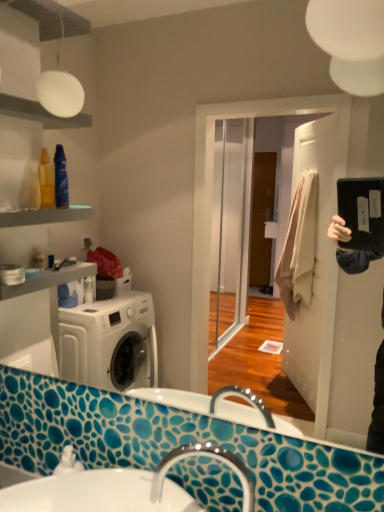
Question: Is silver metallic faucet at lower center inside matte black mirror at upper right?

Choices:
 (A) yes
 (B) no

Answer: (B)

Question: Is matte black mirror at upper right located outside silver metallic faucet at lower center?

Choices:
 (A) yes
 (B) no

Answer: (A)

Question: Does matte black mirror at upper right have a greater height compared to silver metallic faucet at lower center?

Choices:
 (A) no
 (B) yes

Answer: (B)

Question: Is matte black mirror at upper right thinner than silver metallic faucet at lower center?

Choices:
 (A) no
 (B) yes

Answer: (B)

Question: Does matte black mirror at upper right have a lesser height compared to silver metallic faucet at lower center?

Choices:
 (A) no
 (B) yes

Answer: (A)

Question: Considering the relative sizes of matte black mirror at upper right and silver metallic faucet at lower center in the image provided, is matte black mirror at upper right wider than silver metallic faucet at lower center?

Choices:
 (A) no
 (B) yes

Answer: (A)

Question: Is white glossy sink at lower center thinner than silver metallic faucet at lower center?

Choices:
 (A) no
 (B) yes

Answer: (A)

Question: Is white glossy sink at lower center outside silver metallic faucet at lower center?

Choices:
 (A) no
 (B) yes

Answer: (B)

Question: Is silver metallic faucet at lower center completely or partially inside white glossy sink at lower center?

Choices:
 (A) no
 (B) yes

Answer: (A)

Question: Is white glossy sink at lower center turned away from silver metallic faucet at lower center?

Choices:
 (A) yes
 (B) no

Answer: (B)

Question: Is white glossy sink at lower center shorter than silver metallic faucet at lower center?

Choices:
 (A) no
 (B) yes

Answer: (B)

Question: Can you confirm if white glossy sink at lower center is bigger than silver metallic faucet at lower center?

Choices:
 (A) no
 (B) yes

Answer: (B)

Question: Is silver metallic faucet at lower center not inside matte black mirror at upper right?

Choices:
 (A) no
 (B) yes

Answer: (B)